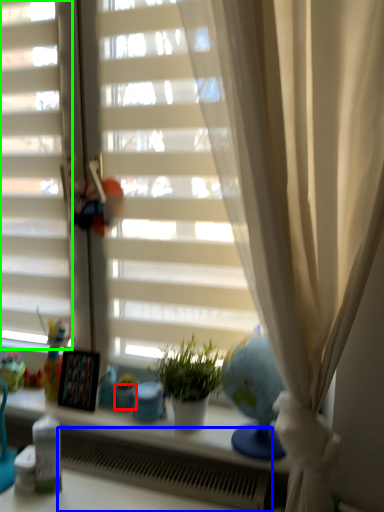
Question: Estimate the real-world distances between objects in this image. Which object is farther from glass vase (highlighted by a red box), radiator (highlighted by a blue box) or shutter (highlighted by a green box)?

Choices:
 (A) radiator
 (B) shutter

Answer: (B)